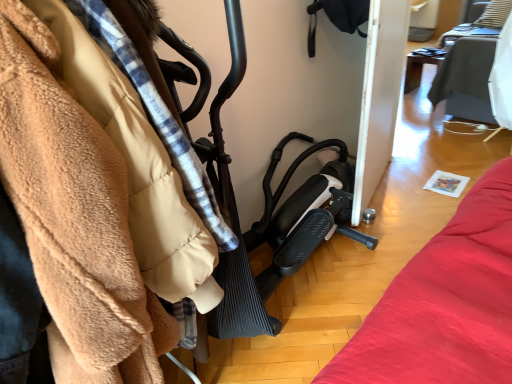
The width and height of the screenshot is (512, 384). Find the location of `wooden table at upper right`. wooden table at upper right is located at coordinates pos(420,66).

The width and height of the screenshot is (512, 384). What do you see at coordinates (420, 66) in the screenshot?
I see `wooden table at upper right` at bounding box center [420, 66].

Describe the element at coordinates (237, 210) in the screenshot. I see `black rubber baby carriage at center` at that location.

This screenshot has width=512, height=384. In order to click on black rubber baby carriage at center in this screenshot , I will do `click(237, 210)`.

I want to click on wooden table at upper right, so click(x=420, y=66).

Does black rubber baby carriage at center appear on the left side of wooden table at upper right?

Indeed, black rubber baby carriage at center is positioned on the left side of wooden table at upper right.

Is black rubber baby carriage at center closer to camera compared to wooden table at upper right?

Yes, black rubber baby carriage at center is closer to the viewer.

Considering the positions of points (258, 237) and (419, 71), is point (258, 237) farther from camera compared to point (419, 71)?

No.

From the image's perspective, who appears lower, black rubber baby carriage at center or wooden table at upper right?

black rubber baby carriage at center is shown below in the image.

From the picture: From a real-world perspective, who is located higher, black rubber baby carriage at center or wooden table at upper right?

black rubber baby carriage at center is physically above.

Which object is wider, black rubber baby carriage at center or wooden table at upper right?

With larger width is black rubber baby carriage at center.

Looking at this image, considering the relative sizes of black rubber baby carriage at center and wooden table at upper right in the image provided, is black rubber baby carriage at center shorter than wooden table at upper right?

No, black rubber baby carriage at center is not shorter than wooden table at upper right.

In terms of size, does black rubber baby carriage at center appear bigger or smaller than wooden table at upper right?

Clearly, black rubber baby carriage at center is larger in size than wooden table at upper right.

Is black rubber baby carriage at center not inside wooden table at upper right?

That's correct, black rubber baby carriage at center is outside of wooden table at upper right.

Is black rubber baby carriage at center placed right next to wooden table at upper right?

There is a gap between black rubber baby carriage at center and wooden table at upper right.

From the picture: Could you tell me if black rubber baby carriage at center is facing wooden table at upper right?

No.

In the scene shown: What's the angular difference between black rubber baby carriage at center and wooden table at upper right's facing directions?

86.8 degrees.

Identify the location of baby carriage in front of the wooden table at upper right. The width and height of the screenshot is (512, 384). (237, 210).

Does wooden table at upper right appear on the right side of black rubber baby carriage at center?

Indeed, wooden table at upper right is positioned on the right side of black rubber baby carriage at center.

Is the position of wooden table at upper right less distant than that of black rubber baby carriage at center?

No, it is behind black rubber baby carriage at center.

Which is behind, point (418, 58) or point (214, 151)?

The point (418, 58) is farther from the camera.

From the image's perspective, which one is positioned higher, wooden table at upper right or black rubber baby carriage at center?

wooden table at upper right.

From a real-world perspective, who is located higher, wooden table at upper right or black rubber baby carriage at center?

From a 3D spatial view, black rubber baby carriage at center is above.

Which of these two, wooden table at upper right or black rubber baby carriage at center, is wider?

black rubber baby carriage at center.

Between wooden table at upper right and black rubber baby carriage at center, which one has more height?

black rubber baby carriage at center.

Considering the relative sizes of wooden table at upper right and black rubber baby carriage at center in the image provided, is wooden table at upper right smaller than black rubber baby carriage at center?

Indeed, wooden table at upper right has a smaller size compared to black rubber baby carriage at center.

Is black rubber baby carriage at center completely or partially inside wooden table at upper right?

No, wooden table at upper right does not contain black rubber baby carriage at center.

Looking at this image, is wooden table at upper right not close to black rubber baby carriage at center?

Absolutely, wooden table at upper right is distant from black rubber baby carriage at center.

Is wooden table at upper right looking in the opposite direction of black rubber baby carriage at center?

No, wooden table at upper right is not facing away from black rubber baby carriage at center.

How different are the orientations of wooden table at upper right and black rubber baby carriage at center in degrees?

They differ by 86.8 degrees in their facing directions.

What are the coordinates of `baby carriage above the wooden table at upper right (from a real-world perspective)` in the screenshot? It's located at (237, 210).

The width and height of the screenshot is (512, 384). In order to click on baby carriage located below the wooden table at upper right (from the image's perspective) in this screenshot , I will do `click(237, 210)`.

Identify the location of furniture on the right side of black rubber baby carriage at center. The image size is (512, 384). (420, 66).